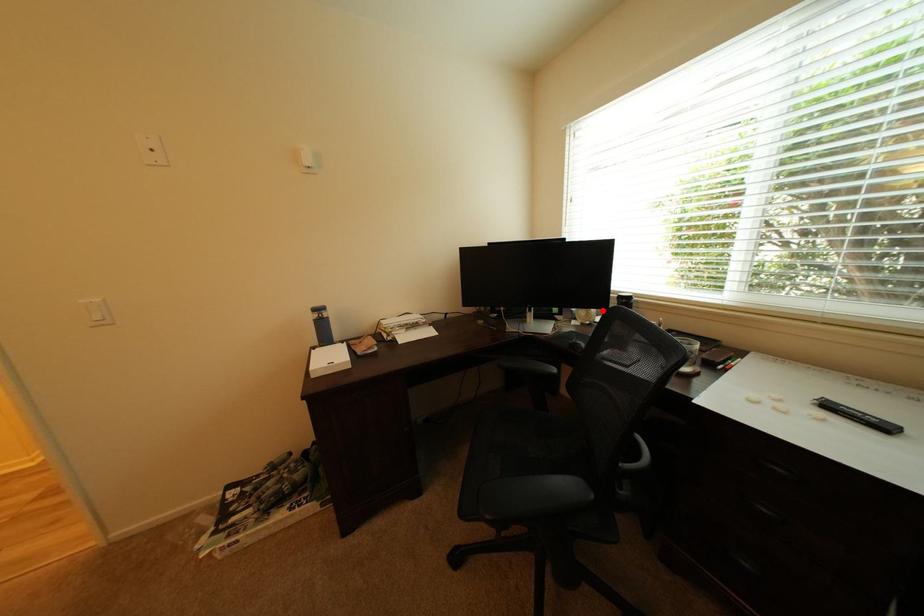
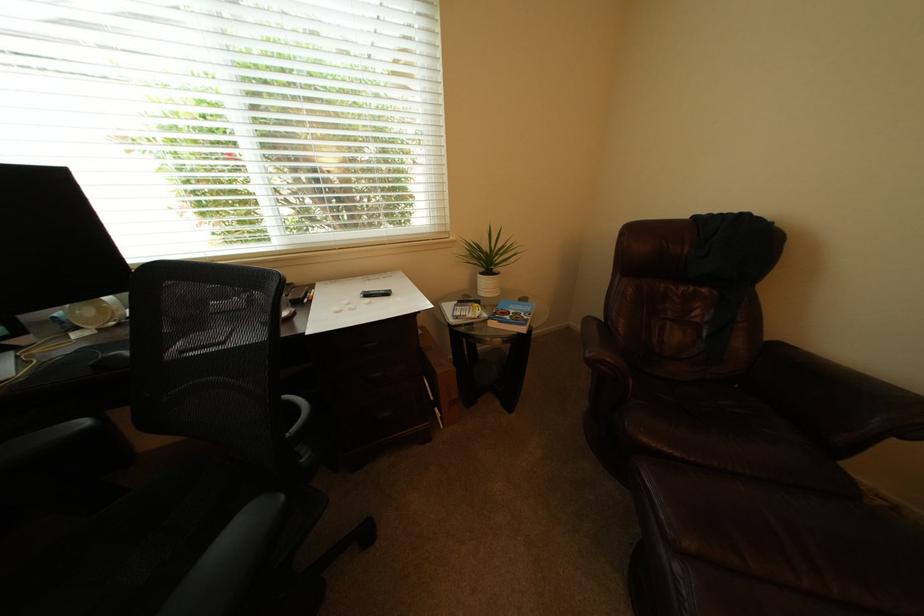
In the second image, find the point that corresponds to the highlighted location in the first image.

(116, 300)